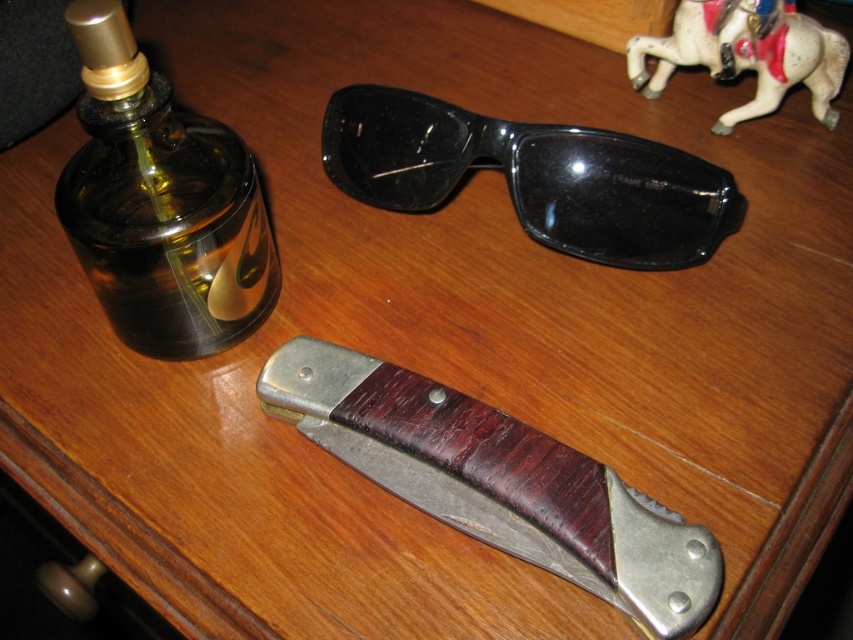
How far apart are green glass bottle at left and black plastic sunglasses at center?

A distance of 12.21 inches exists between green glass bottle at left and black plastic sunglasses at center.

Is point (119, 129) farther from camera compared to point (413, 134)?

No.

What are the coordinates of `green glass bottle at left` in the screenshot? It's located at (160, 204).

Is green glass bottle at left in front of metallic horse at upper right?

Yes, green glass bottle at left is closer to the viewer.

Can you confirm if green glass bottle at left is positioned to the right of metallic horse at upper right?

Incorrect, green glass bottle at left is not on the right side of metallic horse at upper right.

Which is behind, point (131, 173) or point (630, 45)?

The point (630, 45) is behind.

I want to click on green glass bottle at left, so click(x=160, y=204).

Does wooden-handled folding knife at center appear over black plastic sunglasses at center?

Incorrect, wooden-handled folding knife at center is not positioned above black plastic sunglasses at center.

Does wooden-handled folding knife at center have a greater height compared to black plastic sunglasses at center?

Indeed, wooden-handled folding knife at center has a greater height compared to black plastic sunglasses at center.

This screenshot has width=853, height=640. In order to click on wooden-handled folding knife at center in this screenshot , I will do `click(497, 481)`.